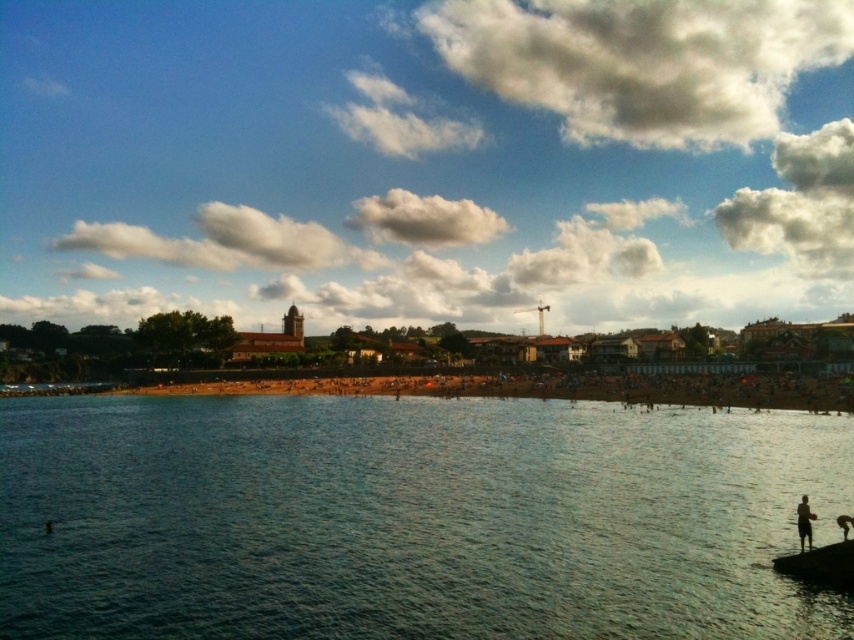
Is clear blue water at center to the right of silhouette human at lower right from the viewer's perspective?

In fact, clear blue water at center is to the left of silhouette human at lower right.

The image size is (854, 640). What do you see at coordinates (411, 516) in the screenshot?
I see `clear blue water at center` at bounding box center [411, 516].

From the picture: Who is more distant from viewer, (x=524, y=429) or (x=810, y=536)?

The point (x=524, y=429) is more distant.

In order to click on clear blue water at center in this screenshot , I will do `click(411, 516)`.